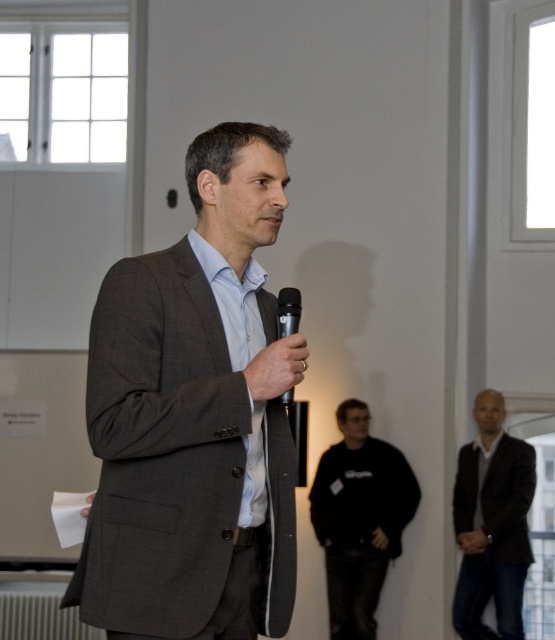
You are a photographer trying to capture a closeup of the dark brown leather jacket at lower right. Based on the scene, where should you position your camera to focus on this object?

The dark brown leather jacket at lower right is located at point (491,524) in 2D coordinates, so you should position your camera to focus on that coordinate to capture the closeup.

You are a photographer setting up for an event. You need to ensure that the black matte sweatshirt at center and the dark brown leather jacket at lower right are both visible in the frame. Given their sizes, which object should you adjust the camera focus to prioritize to ensure the smaller one is in focus?

The dark brown leather jacket at lower right should be prioritized for focus since it is smaller in size and might be harder to capture clearly compared to the larger black matte sweatshirt at center.

You are a photographer trying to capture a clear shot of the speaker. You notice the black matte sweatshirt at center and the dark brown leather jacket at lower right in your frame. Which object should you adjust your focus to ensure the speaker remains sharp?

The dark brown leather jacket at lower right is behind the black matte sweatshirt at center, so to keep the speaker sharp, focus on the black matte sweatshirt at center which is closer to the camera.